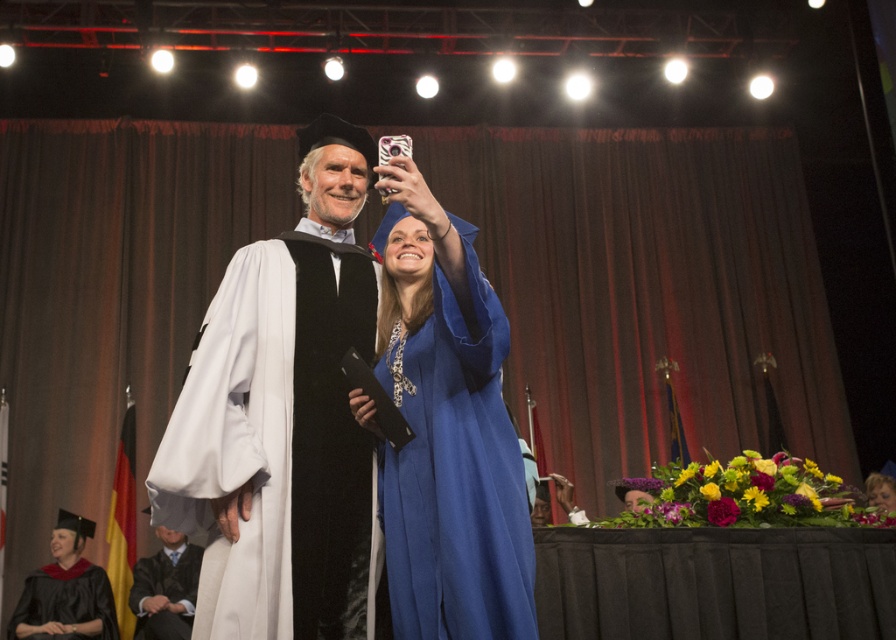
Can you confirm if matte black gown at lower left is positioned below matte black graduation gown at lower left?

Yes, matte black gown at lower left is below matte black graduation gown at lower left.

Does point (95, 593) lie behind point (166, 605)?

Yes, point (95, 593) is farther from viewer.

Locate an element on the screen. The image size is (896, 640). matte black gown at lower left is located at coordinates (65, 600).

Identify the location of matte black gown at lower left. The height and width of the screenshot is (640, 896). (65, 600).

Consider the image. Does matte white gown at center have a larger size compared to matte black gown at lower left?

Yes, matte white gown at center is bigger than matte black gown at lower left.

Is point (259, 413) more distant than point (112, 595)?

That is False.

Identify the location of matte white gown at center. (283, 419).

Is blue satin gown at center to the right of matte black graduation gown at lower left from the viewer's perspective?

Correct, you'll find blue satin gown at center to the right of matte black graduation gown at lower left.

Which is more to the left, blue satin gown at center or matte black graduation gown at lower left?

matte black graduation gown at lower left is more to the left.

Is point (424, 346) positioned before point (132, 611)?

Yes, point (424, 346) is closer to viewer.

The height and width of the screenshot is (640, 896). Identify the location of blue satin gown at center. (448, 432).